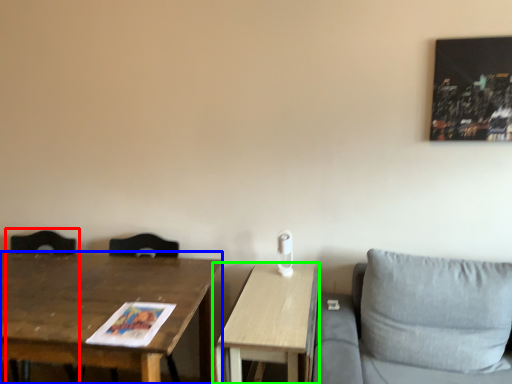
Question: Which object is the closest to the swivel chair (highlighted by a red box)? Choose among these: table (highlighted by a blue box) or table (highlighted by a green box).

Choices:
 (A) table
 (B) table

Answer: (A)